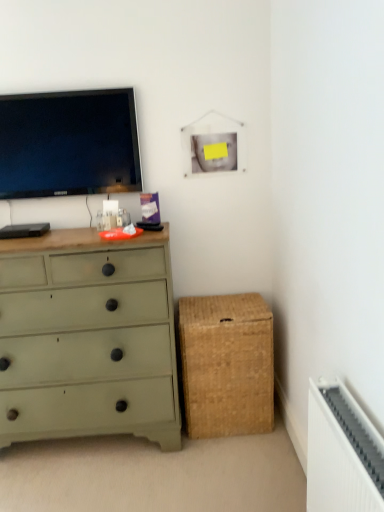
You are a GUI agent. You are given a task and a screenshot of the screen. Output one action in this format:
    pyautogui.click(x=<x>, y=<y>)
    Task: Click on the vacant area in front of braided wicker storage box at lower right
    This screenshot has height=512, width=384.
    Given the screenshot: What is the action you would take?
    pyautogui.click(x=236, y=461)